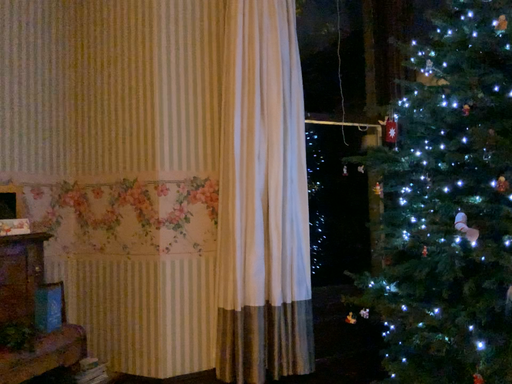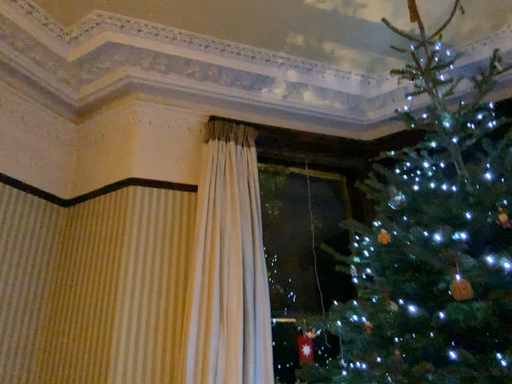
Question: Which way did the camera rotate in the video?

Choices:
 (A) rotated upward
 (B) rotated downward

Answer: (A)